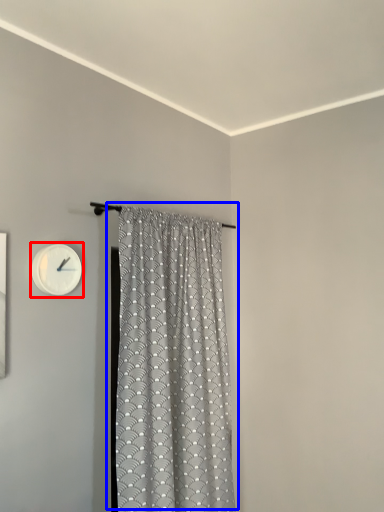
Question: Which object appears farthest to the camera in this image, wall clock (highlighted by a red box) or curtain (highlighted by a blue box)?

Choices:
 (A) wall clock
 (B) curtain

Answer: (A)